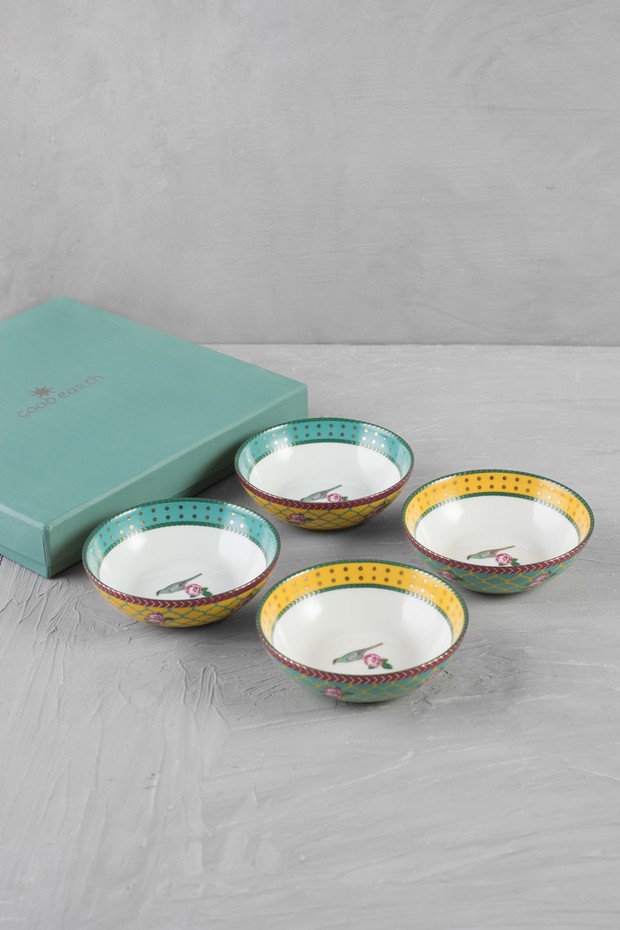
Where is `box`? This screenshot has width=620, height=930. box is located at coordinates (81, 432).